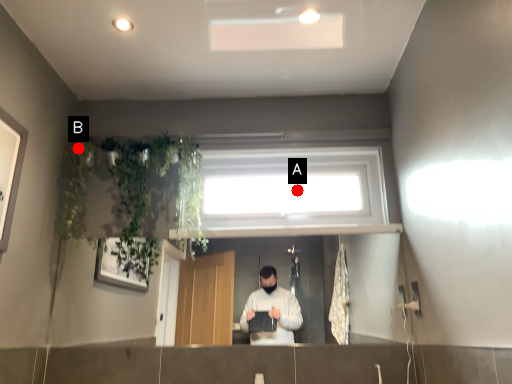
Question: Two points are circled on the image, labeled by A and B beside each circle. Among these points, which one is farthest from the camera?

Choices:
 (A) A is further
 (B) B is further

Answer: (A)